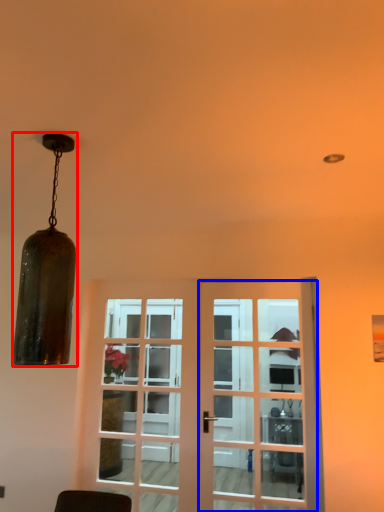
Question: Among these objects, which one is nearest to the camera, lamp (highlighted by a red box) or door (highlighted by a blue box)?

Choices:
 (A) lamp
 (B) door

Answer: (A)